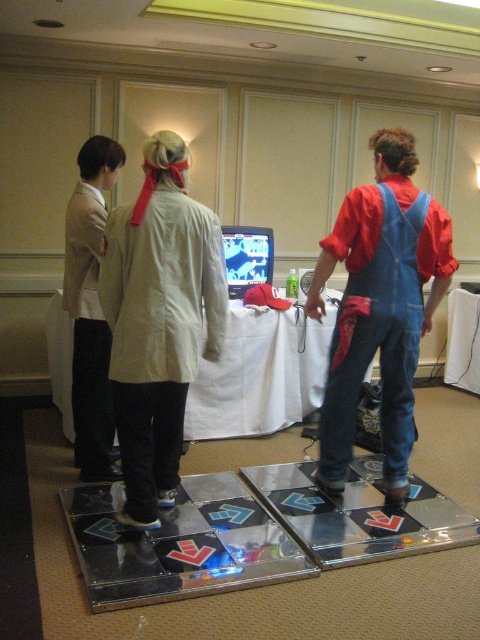
Question: Which object is closer to the camera taking this photo?

Choices:
 (A) light beige fabric coat at center
 (B) light beige fabric jacket at left

Answer: (A)

Question: Which object is farther from the camera taking this photo?

Choices:
 (A) denim overalls at center
 (B) light beige fabric coat at center
 (C) white cloth table at center

Answer: (C)

Question: Is light beige fabric coat at center further to the viewer compared to denim overalls at center?

Choices:
 (A) no
 (B) yes

Answer: (A)

Question: Which point is closer to the camera?

Choices:
 (A) (432, 243)
 (B) (312, 381)
 (C) (181, 333)
 (D) (93, 148)

Answer: (C)

Question: Does white cloth table at center have a lesser width compared to light beige fabric jacket at left?

Choices:
 (A) no
 (B) yes

Answer: (A)

Question: Does light beige fabric coat at center come in front of white cloth table at center?

Choices:
 (A) no
 (B) yes

Answer: (B)